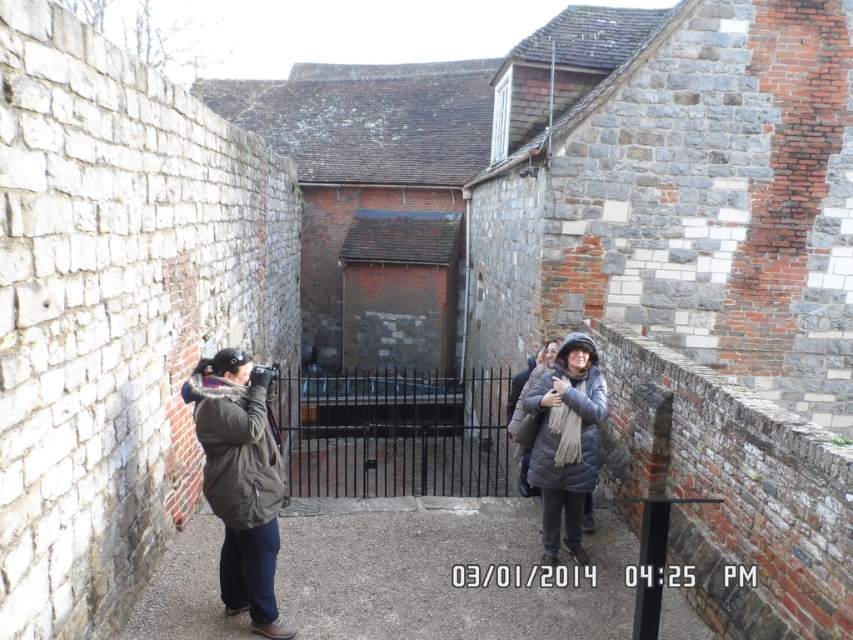
Question: Which object is farther from the camera taking this photo?

Choices:
 (A) dark green jacket at center
 (B) matte gray coat at center

Answer: (B)

Question: Is dark green jacket at center to the right of matte gray coat at center from the viewer's perspective?

Choices:
 (A) yes
 (B) no

Answer: (B)

Question: Which point is closer to the camera?

Choices:
 (A) (595, 465)
 (B) (274, 528)

Answer: (B)

Question: Can you confirm if dark green jacket at center is positioned to the left of matte gray coat at center?

Choices:
 (A) no
 (B) yes

Answer: (B)

Question: Is dark green jacket at center bigger than matte gray coat at center?

Choices:
 (A) yes
 (B) no

Answer: (B)

Question: Which object is farther from the camera taking this photo?

Choices:
 (A) dark green jacket at center
 (B) matte gray coat at center

Answer: (B)